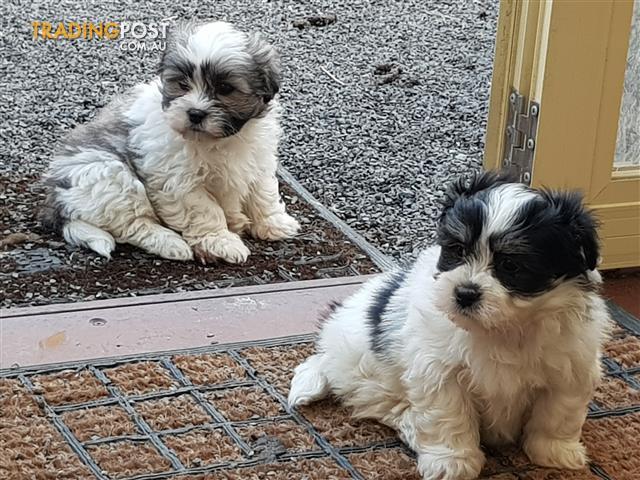
Image resolution: width=640 pixels, height=480 pixels. Identify the location of window. tap(632, 144).